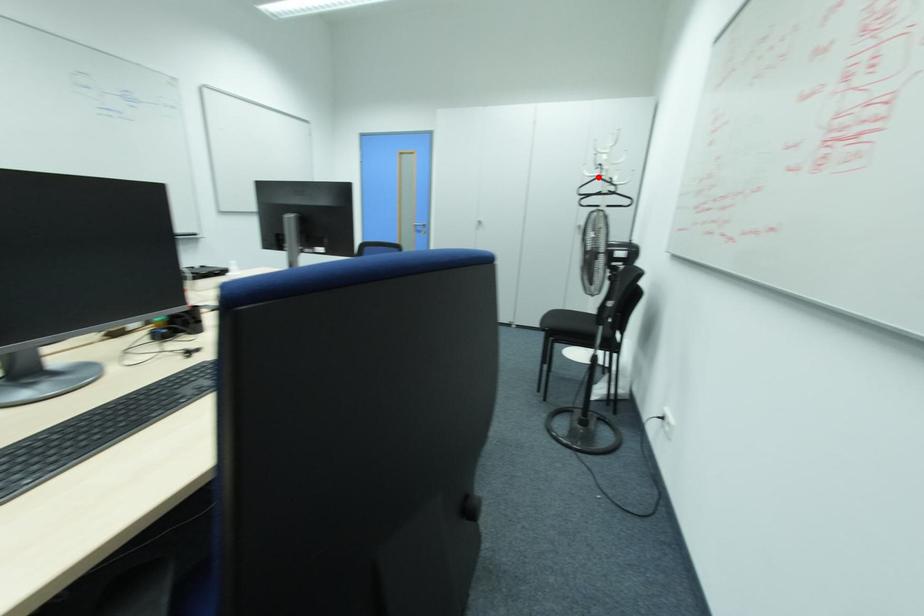
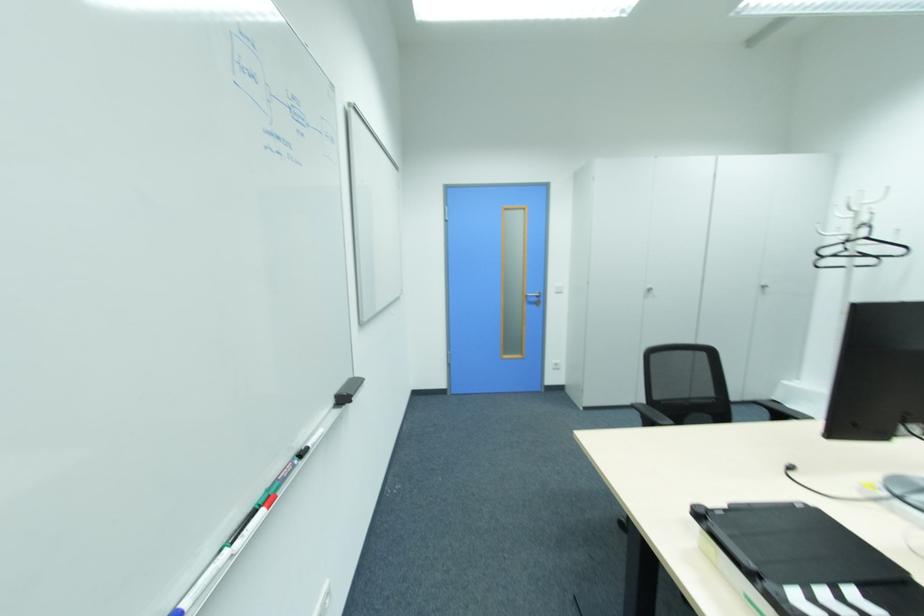
Find the pixel in the second image that matches the highlighted location in the first image.

(865, 238)